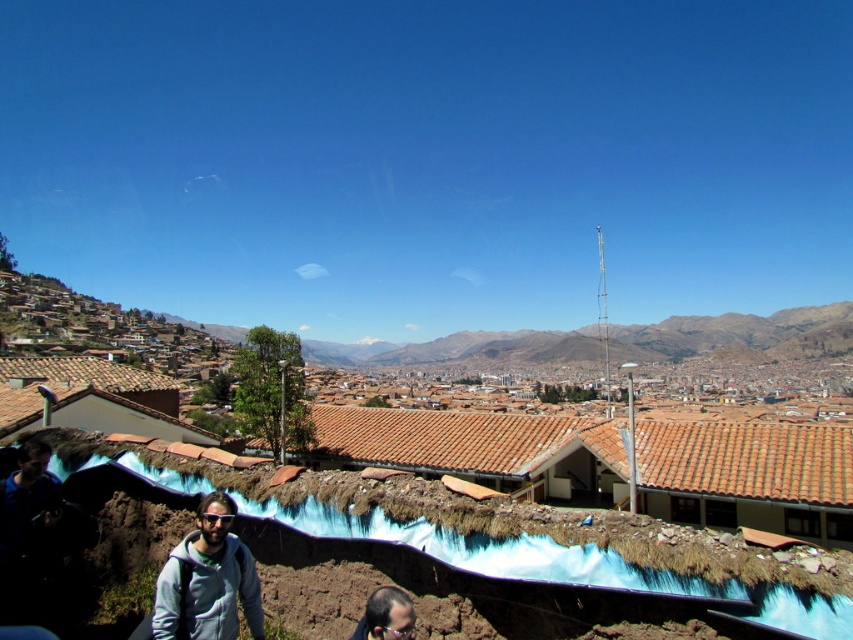
Consider the image. You are a photographer standing in the city valley scene. You notice both the gray fleece jacket at lower center and the smooth brown hair at lower center. Which object is closer to your viewpoint?

The gray fleece jacket at lower center is closer to your viewpoint because the smooth brown hair at lower center is positioned behind it.

You are a photographer standing in the city valley scene. You notice a gray fleece jacket at lower center and a smooth brown hair at lower center. Which object is positioned higher from the ground?

The gray fleece jacket at lower center is above smooth brown hair at lower center, so the gray fleece jacket at lower center is higher from the ground.

You are standing at the point with coordinates point (370, 634) and want to walk towards the point with coordinates point (177, 632). According to the scene description, will the adobe wall with the blue tarp block your path?

Point (177, 632) is behind point (370, 634), so the adobe wall with the blue tarp in the foreground will block your path.